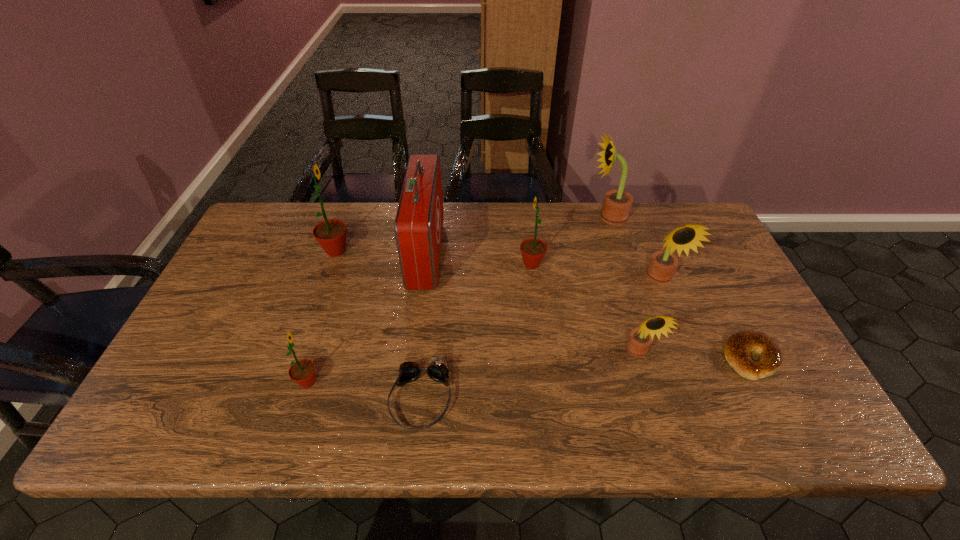
I want to click on the nearest yellow sunflower, so click(x=640, y=339).

This screenshot has width=960, height=540. What are the coordinates of `the eighth tallest object` in the screenshot? It's located at (438, 370).

At what (x,y) coordinates should I click in order to perform the action: click on bronze goggles. Please return your answer as a coordinate pair (x, y). Image resolution: width=960 pixels, height=540 pixels. Looking at the image, I should click on (438, 370).

Identify the location of the shortest object. The height and width of the screenshot is (540, 960). (737, 349).

You are a GUI agent. You are given a task and a screenshot of the screen. Output one action in this format:
    pyautogui.click(x=<x>, y=<y>)
    Task: Click on the brown bagel
    This screenshot has height=540, width=960.
    Given the screenshot: What is the action you would take?
    pyautogui.click(x=737, y=349)

The height and width of the screenshot is (540, 960). I want to click on vacant space situated on the face of the biggest yellow sunflower, so click(484, 217).

The height and width of the screenshot is (540, 960). In order to click on blank space located on the face of the biggest yellow sunflower in this screenshot , I will do `click(556, 217)`.

At what (x,y) coordinates should I click in order to perform the action: click on free space located 0.130m on the face of the biggest yellow sunflower. Please return your answer as a coordinate pair (x, y). Looking at the image, I should click on (550, 217).

Where is `free region located 0.210m on the face of the biggest green sunflower`? free region located 0.210m on the face of the biggest green sunflower is located at coordinates coord(420,251).

The width and height of the screenshot is (960, 540). I want to click on free space located 0.350m on the side of the first-aid kit with the first aid cross symbol, so 556,253.